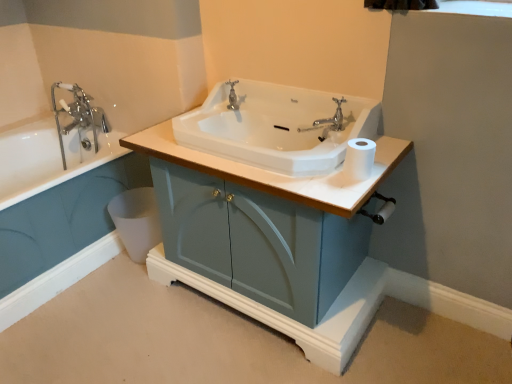
Where is `vacant area in front of white matte toilet paper at right`? This screenshot has width=512, height=384. vacant area in front of white matte toilet paper at right is located at coordinates (353, 184).